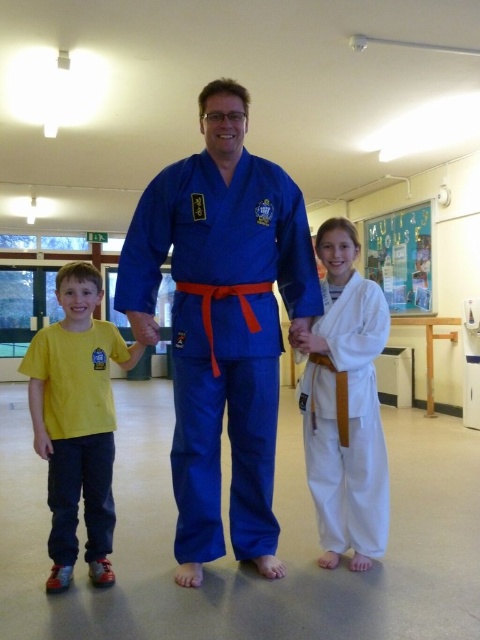
Does blue fabric karate uniform at center appear on the left side of yellow cotton t-shirt at left?

No, blue fabric karate uniform at center is not to the left of yellow cotton t-shirt at left.

Does blue fabric karate uniform at center come behind yellow cotton t-shirt at left?

Result: Yes, blue fabric karate uniform at center is behind yellow cotton t-shirt at left.

Find the location of a particular element. The width and height of the screenshot is (480, 640). blue fabric karate uniform at center is located at coordinates (222, 323).

Is white cotton karate uniform at center wider than yellow cotton t-shirt at left?

Incorrect, white cotton karate uniform at center's width does not surpass yellow cotton t-shirt at left's.

Does white cotton karate uniform at center appear on the right side of yellow cotton t-shirt at left?

Indeed, white cotton karate uniform at center is positioned on the right side of yellow cotton t-shirt at left.

Describe the element at coordinates (345, 404) in the screenshot. I see `white cotton karate uniform at center` at that location.

Identify the location of white cotton karate uniform at center. (345, 404).

Is blue fabric karate uniform at center positioned in front of white cotton karate uniform at center?

Yes, blue fabric karate uniform at center is in front of white cotton karate uniform at center.

Who is more forward, (x=146, y=280) or (x=324, y=496)?

Point (x=146, y=280) is in front.

Which is in front, point (203, 404) or point (350, 403)?

Point (203, 404) is more forward.

You are a GUI agent. You are given a task and a screenshot of the screen. Output one action in this format:
    pyautogui.click(x=<x>, y=<y>)
    Task: Click on the blue fabric karate uniform at center
    Image resolution: width=480 pixels, height=640 pixels.
    Given the screenshot: What is the action you would take?
    pyautogui.click(x=222, y=323)